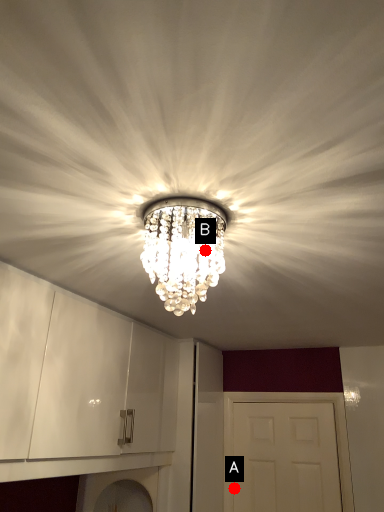
Question: Two points are circled on the image, labeled by A and B beside each circle. Which of the following is the closest to the observer?

Choices:
 (A) A is closer
 (B) B is closer

Answer: (B)